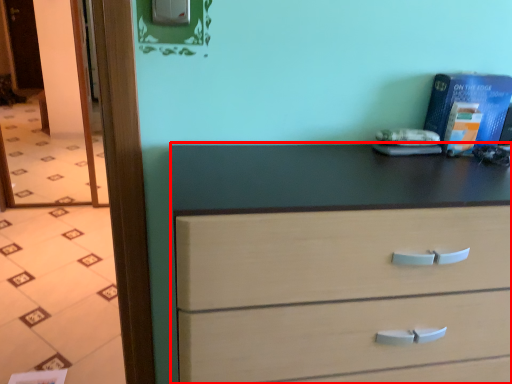
Question: In this image, where is chest of drawers (annotated by the red box) located relative to glass door?

Choices:
 (A) left
 (B) right

Answer: (B)